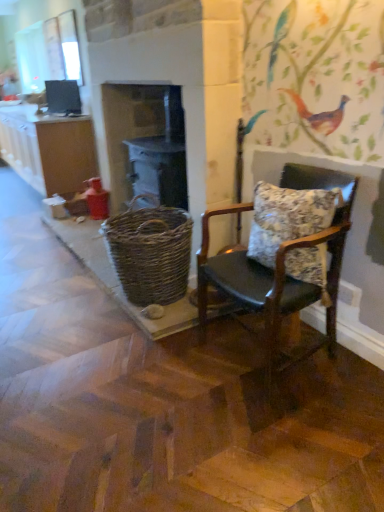
Question: Is woven brown basket at center closer to the viewer compared to clear glass window at upper left?

Choices:
 (A) no
 (B) yes

Answer: (B)

Question: Is woven brown basket at center not near clear glass window at upper left?

Choices:
 (A) no
 (B) yes

Answer: (B)

Question: Considering the relative sizes of woven brown basket at center and clear glass window at upper left in the image provided, is woven brown basket at center smaller than clear glass window at upper left?

Choices:
 (A) no
 (B) yes

Answer: (A)

Question: From a real-world perspective, is woven brown basket at center positioned under clear glass window at upper left based on gravity?

Choices:
 (A) no
 (B) yes

Answer: (B)

Question: Is woven brown basket at center facing towards clear glass window at upper left?

Choices:
 (A) no
 (B) yes

Answer: (A)

Question: Are woven brown basket at center and clear glass window at upper left beside each other?

Choices:
 (A) yes
 (B) no

Answer: (B)

Question: Could you tell me if leather cushioned chair at right is turned towards matte brown cabinet at left?

Choices:
 (A) no
 (B) yes

Answer: (A)

Question: Is leather cushioned chair at right wider than matte brown cabinet at left?

Choices:
 (A) yes
 (B) no

Answer: (B)

Question: From a real-world perspective, is leather cushioned chair at right over matte brown cabinet at left?

Choices:
 (A) yes
 (B) no

Answer: (A)

Question: Can you confirm if leather cushioned chair at right is taller than matte brown cabinet at left?

Choices:
 (A) no
 (B) yes

Answer: (B)

Question: Is the surface of leather cushioned chair at right in direct contact with matte brown cabinet at left?

Choices:
 (A) yes
 (B) no

Answer: (B)

Question: Is leather cushioned chair at right smaller than matte brown cabinet at left?

Choices:
 (A) yes
 (B) no

Answer: (A)

Question: Is floral fabric pillow at right thinner than woven brown basket at center?

Choices:
 (A) no
 (B) yes

Answer: (B)